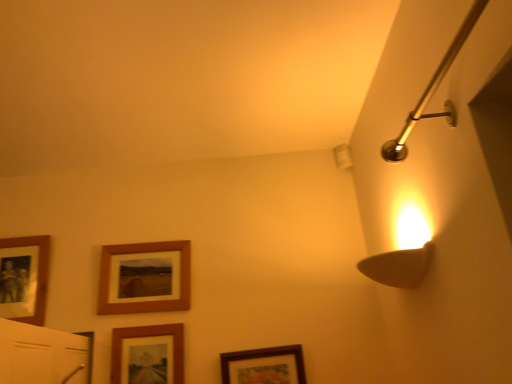
Describe the element at coordinates (434, 90) in the screenshot. Image resolution: width=512 pixels, height=384 pixels. I see `polished brass shower arm at upper right` at that location.

Identify the location of wooden photo frame at left, the 1th picture frame positioned from the left. (24, 277).

Describe the element at coordinates (24, 277) in the screenshot. I see `wooden photo frame at left, the 1th picture frame positioned from the left` at that location.

What is the approximate height of wooden framed picture at lower center, arranged as the 3th picture frame when viewed from the left?

wooden framed picture at lower center, arranged as the 3th picture frame when viewed from the left, is 15.47 inches tall.

Where is `wooden framed picture at lower center, placed as the first picture frame when sorted from right to left`? The height and width of the screenshot is (384, 512). wooden framed picture at lower center, placed as the first picture frame when sorted from right to left is located at coordinates (264, 366).

How many degrees apart are the facing directions of wooden photo frame at left, acting as the fourth picture frame starting from the right, and wooden framed picture at lower center, arranged as the 3th picture frame when viewed from the left?

wooden photo frame at left, acting as the fourth picture frame starting from the right, and wooden framed picture at lower center, arranged as the 3th picture frame when viewed from the left, are facing 1.33 degrees away from each other.

In the scene shown: From a real-world perspective, between wooden photo frame at left, the 1th picture frame positioned from the left, and wooden framed picture at lower center, arranged as the 3th picture frame when viewed from the left, who is vertically higher?

From a 3D spatial view, wooden photo frame at left, the 1th picture frame positioned from the left, is above.

Would you say wooden photo frame at left, acting as the fourth picture frame starting from the right, is to the left or to the right of wooden framed picture at lower center, arranged as the 2th picture frame when viewed from the right, in the picture?

Based on their positions, wooden photo frame at left, acting as the fourth picture frame starting from the right, is located to the left of wooden framed picture at lower center, arranged as the 2th picture frame when viewed from the right.

Based on the photo, in terms of size, does wooden photo frame at left, the 1th picture frame positioned from the left, appear bigger or smaller than wooden framed picture at lower center, arranged as the 3th picture frame when viewed from the left?

wooden photo frame at left, the 1th picture frame positioned from the left, is bigger than wooden framed picture at lower center, arranged as the 3th picture frame when viewed from the left.

From the image's perspective, between polished brass shower arm at upper right and wooden framed picture at lower center, placed as the 4th picture frame when sorted from left to right, which one is located above?

From the image's view, polished brass shower arm at upper right is above.

Measure the distance from polished brass shower arm at upper right to wooden framed picture at lower center, placed as the first picture frame when sorted from right to left.

polished brass shower arm at upper right and wooden framed picture at lower center, placed as the first picture frame when sorted from right to left, are 38.52 inches apart from each other.

Between polished brass shower arm at upper right and wooden framed picture at lower center, placed as the first picture frame when sorted from right to left, which one has smaller width?

Thinner between the two is wooden framed picture at lower center, placed as the first picture frame when sorted from right to left.

Is polished brass shower arm at upper right oriented away from wooden framed picture at lower center, placed as the 4th picture frame when sorted from left to right?

polished brass shower arm at upper right does not have its back to wooden framed picture at lower center, placed as the 4th picture frame when sorted from left to right.

From the picture: Can we say wooden picture frame at center, which ranks as the 3th picture frame in right-to-left order, lies outside wooden framed picture at lower center, placed as the first picture frame when sorted from right to left?

Yes, wooden picture frame at center, which ranks as the 3th picture frame in right-to-left order, is located beyond the bounds of wooden framed picture at lower center, placed as the first picture frame when sorted from right to left.

Is wooden picture frame at center, which ranks as the 3th picture frame in right-to-left order, far from wooden framed picture at lower center, placed as the 4th picture frame when sorted from left to right?

No, wooden picture frame at center, which ranks as the 3th picture frame in right-to-left order, is in close proximity to wooden framed picture at lower center, placed as the 4th picture frame when sorted from left to right.

Is wooden picture frame at center, which ranks as the 3th picture frame in right-to-left order, to the left of wooden framed picture at lower center, placed as the 4th picture frame when sorted from left to right, from the viewer's perspective?

Indeed, wooden picture frame at center, which ranks as the 3th picture frame in right-to-left order, is positioned on the left side of wooden framed picture at lower center, placed as the 4th picture frame when sorted from left to right.

Consider the image. Is wooden picture frame at center, the second picture frame in the left-to-right sequence, wider than wooden framed picture at lower center, placed as the first picture frame when sorted from right to left?

Yes, wooden picture frame at center, the second picture frame in the left-to-right sequence, is wider than wooden framed picture at lower center, placed as the first picture frame when sorted from right to left.

How many degrees apart are the facing directions of wooden picture frame at center, the second picture frame in the left-to-right sequence, and wooden photo frame at left, the 1th picture frame positioned from the left?

There is a 1.33-degree angle between the facing directions of wooden picture frame at center, the second picture frame in the left-to-right sequence, and wooden photo frame at left, the 1th picture frame positioned from the left.

Does wooden picture frame at center, the second picture frame in the left-to-right sequence, have a lesser height compared to wooden photo frame at left, acting as the fourth picture frame starting from the right?

Yes.

Can wooden photo frame at left, the 1th picture frame positioned from the left, be found inside wooden picture frame at center, which ranks as the 3th picture frame in right-to-left order?

Actually, wooden photo frame at left, the 1th picture frame positioned from the left, is outside wooden picture frame at center, which ranks as the 3th picture frame in right-to-left order.

Is there a large distance between wooden picture frame at center, which ranks as the 3th picture frame in right-to-left order, and wooden photo frame at left, the 1th picture frame positioned from the left?

That's not correct — wooden picture frame at center, which ranks as the 3th picture frame in right-to-left order, is a little close to wooden photo frame at left, the 1th picture frame positioned from the left.

Does polished brass shower arm at upper right contain wooden photo frame at left, the 1th picture frame positioned from the left?

No, wooden photo frame at left, the 1th picture frame positioned from the left, is not a part of polished brass shower arm at upper right.

Is polished brass shower arm at upper right placed right next to wooden photo frame at left, acting as the fourth picture frame starting from the right?

No, polished brass shower arm at upper right is not next to wooden photo frame at left, acting as the fourth picture frame starting from the right.

Is wooden photo frame at left, the 1th picture frame positioned from the left, at the back of polished brass shower arm at upper right?

That's not correct — polished brass shower arm at upper right is not looking away from wooden photo frame at left, the 1th picture frame positioned from the left.

Does polished brass shower arm at upper right have a lesser height compared to wooden photo frame at left, acting as the fourth picture frame starting from the right?

Correct, polished brass shower arm at upper right is not as tall as wooden photo frame at left, acting as the fourth picture frame starting from the right.

Consider the image. Is wooden framed picture at lower center, placed as the 4th picture frame when sorted from left to right, positioned with its back to wooden framed picture at lower center, arranged as the 3th picture frame when viewed from the left?

No, wooden framed picture at lower center, placed as the 4th picture frame when sorted from left to right,'s orientation is not away from wooden framed picture at lower center, arranged as the 3th picture frame when viewed from the left.

Is wooden framed picture at lower center, placed as the 4th picture frame when sorted from left to right, wider than wooden framed picture at lower center, arranged as the 2th picture frame when viewed from the right?

Indeed, wooden framed picture at lower center, placed as the 4th picture frame when sorted from left to right, has a greater width compared to wooden framed picture at lower center, arranged as the 2th picture frame when viewed from the right.

Is point (263, 348) behind point (160, 341)?

No.

In the image, is wooden framed picture at lower center, placed as the 4th picture frame when sorted from left to right, positioned in front of or behind wooden framed picture at lower center, arranged as the 3th picture frame when viewed from the left?

Clearly, wooden framed picture at lower center, placed as the 4th picture frame when sorted from left to right, is in front of wooden framed picture at lower center, arranged as the 3th picture frame when viewed from the left.

Is wooden picture frame at center, the second picture frame in the left-to-right sequence, not near polished brass shower arm at upper right?

Yes, wooden picture frame at center, the second picture frame in the left-to-right sequence, is far from polished brass shower arm at upper right.

Locate an element on the screen. The height and width of the screenshot is (384, 512). shower on the right of wooden picture frame at center, which ranks as the 3th picture frame in right-to-left order is located at coordinates (434, 90).

From the image's perspective, which is below, wooden picture frame at center, which ranks as the 3th picture frame in right-to-left order, or polished brass shower arm at upper right?

wooden picture frame at center, which ranks as the 3th picture frame in right-to-left order, appears lower in the image.

Considering the sizes of objects wooden picture frame at center, which ranks as the 3th picture frame in right-to-left order, and polished brass shower arm at upper right in the image provided, who is wider, wooden picture frame at center, which ranks as the 3th picture frame in right-to-left order, or polished brass shower arm at upper right?

Wider between the two is polished brass shower arm at upper right.

From the wooden photo frame at left, the 1th picture frame positioned from the left, count 2nd picture frame to the right and point to it. Please provide its 2D coordinates.

[(148, 355)]

Locate an element on the screen. the 1st picture frame to the left when counting from the polished brass shower arm at upper right is located at coordinates (264, 366).

From the image, which object appears to be farther from polished brass shower arm at upper right, wooden photo frame at left, the 1th picture frame positioned from the left, or wooden picture frame at center, which ranks as the 3th picture frame in right-to-left order?

The object further to polished brass shower arm at upper right is wooden photo frame at left, the 1th picture frame positioned from the left.

Looking at the image, which one is located closer to polished brass shower arm at upper right, wooden framed picture at lower center, placed as the first picture frame when sorted from right to left, or wooden photo frame at left, the 1th picture frame positioned from the left?

Among the two, wooden framed picture at lower center, placed as the first picture frame when sorted from right to left, is located nearer to polished brass shower arm at upper right.

Looking at this image, considering their positions, is wooden framed picture at lower center, arranged as the 2th picture frame when viewed from the right, positioned closer to wooden photo frame at left, acting as the fourth picture frame starting from the right, than wooden picture frame at center, which ranks as the 3th picture frame in right-to-left order?

Among the two, wooden picture frame at center, which ranks as the 3th picture frame in right-to-left order, is located nearer to wooden photo frame at left, acting as the fourth picture frame starting from the right.

Looking at the image, which one is located further to wooden framed picture at lower center, placed as the 4th picture frame when sorted from left to right, polished brass shower arm at upper right or wooden photo frame at left, the 1th picture frame positioned from the left?

polished brass shower arm at upper right lies further to wooden framed picture at lower center, placed as the 4th picture frame when sorted from left to right, than the other object.

Which object lies further to the anchor point wooden framed picture at lower center, arranged as the 2th picture frame when viewed from the right, wooden photo frame at left, the 1th picture frame positioned from the left, or polished brass shower arm at upper right?

polished brass shower arm at upper right.

Looking at the image, which one is located closer to wooden picture frame at center, the second picture frame in the left-to-right sequence, wooden photo frame at left, the 1th picture frame positioned from the left, or polished brass shower arm at upper right?

Based on the image, wooden photo frame at left, the 1th picture frame positioned from the left, appears to be nearer to wooden picture frame at center, the second picture frame in the left-to-right sequence.

Based on their spatial positions, is polished brass shower arm at upper right or wooden framed picture at lower center, arranged as the 3th picture frame when viewed from the left, closer to wooden picture frame at center, the second picture frame in the left-to-right sequence?

wooden framed picture at lower center, arranged as the 3th picture frame when viewed from the left, is closer to wooden picture frame at center, the second picture frame in the left-to-right sequence.

From the image, which object appears to be farther from wooden framed picture at lower center, placed as the first picture frame when sorted from right to left, wooden framed picture at lower center, arranged as the 3th picture frame when viewed from the left, or wooden photo frame at left, the 1th picture frame positioned from the left?

The object further to wooden framed picture at lower center, placed as the first picture frame when sorted from right to left, is wooden photo frame at left, the 1th picture frame positioned from the left.

Locate an element on the screen. This screenshot has width=512, height=384. picture frame situated between wooden picture frame at center, which ranks as the 3th picture frame in right-to-left order, and wooden framed picture at lower center, placed as the first picture frame when sorted from right to left, from left to right is located at coordinates (148, 355).

The width and height of the screenshot is (512, 384). In order to click on picture frame between wooden photo frame at left, acting as the fourth picture frame starting from the right, and wooden framed picture at lower center, arranged as the 3th picture frame when viewed from the left, in the horizontal direction in this screenshot , I will do `click(143, 280)`.